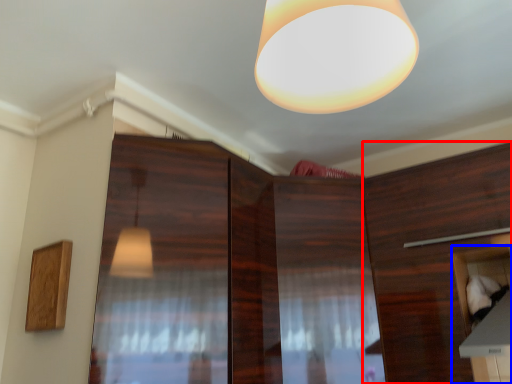
Question: Which object appears farthest to the camera in this image, cabinetry (highlighted by a red box) or cabinetry (highlighted by a blue box)?

Choices:
 (A) cabinetry
 (B) cabinetry

Answer: (A)